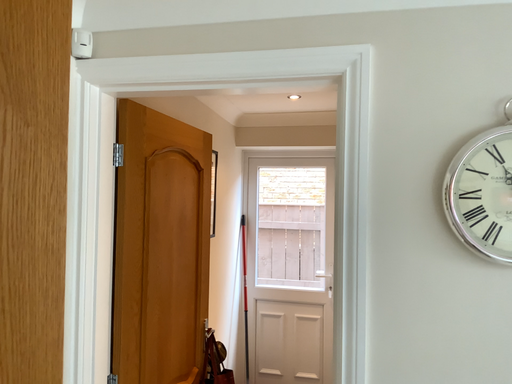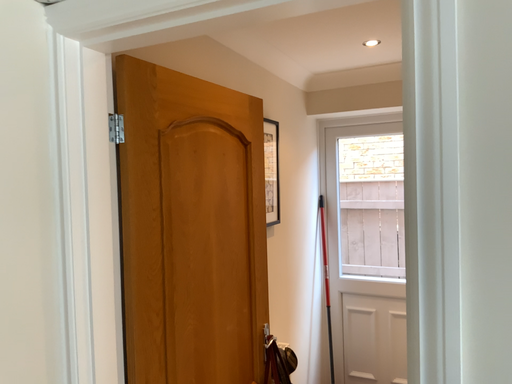
Question: Which way did the camera rotate in the video?

Choices:
 (A) rotated left
 (B) rotated right

Answer: (A)